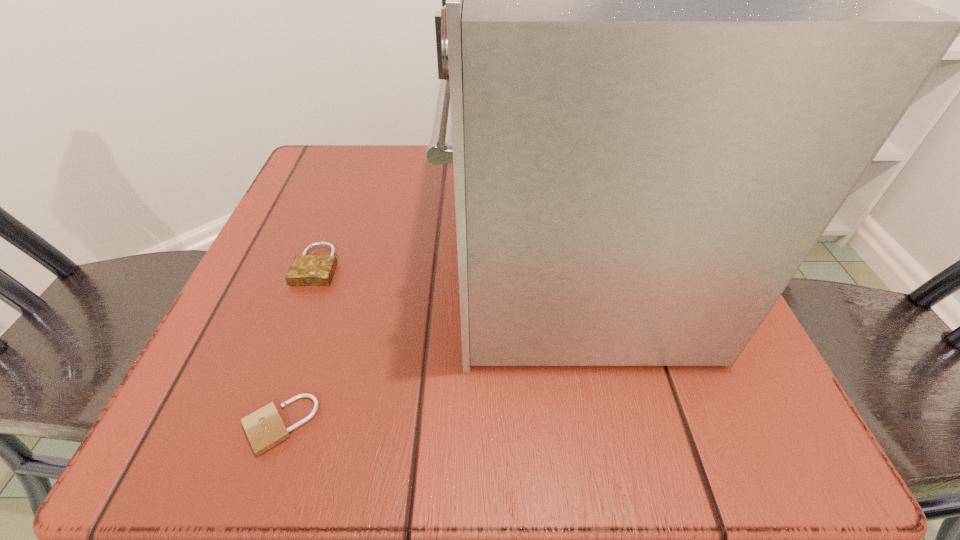
Locate an element on the screen. The width and height of the screenshot is (960, 540). the rightmost object is located at coordinates (677, 26).

Image resolution: width=960 pixels, height=540 pixels. Find the location of `toaster oven`. toaster oven is located at coordinates (677, 26).

Identify the location of the second shortest object. This screenshot has height=540, width=960. (306, 270).

Locate an element on the screen. the taller padlock is located at coordinates (306, 270).

This screenshot has width=960, height=540. In order to click on the shorter padlock in this screenshot , I will do pos(265,428).

Where is `the shortest object`? The image size is (960, 540). the shortest object is located at coordinates (265, 428).

Where is `vacant space located on the front panel of the tallest object`? vacant space located on the front panel of the tallest object is located at coordinates (343, 262).

Where is `free location located 0.280m on the front panel of the tallest object`? The height and width of the screenshot is (540, 960). free location located 0.280m on the front panel of the tallest object is located at coordinates (282, 262).

Where is `vacant space located 0.240m on the front panel of the tallest object`? Image resolution: width=960 pixels, height=540 pixels. vacant space located 0.240m on the front panel of the tallest object is located at coordinates (307, 262).

This screenshot has height=540, width=960. Find the location of `vacant space located 0.160m on the keyhole side of the farther padlock`. vacant space located 0.160m on the keyhole side of the farther padlock is located at coordinates (276, 374).